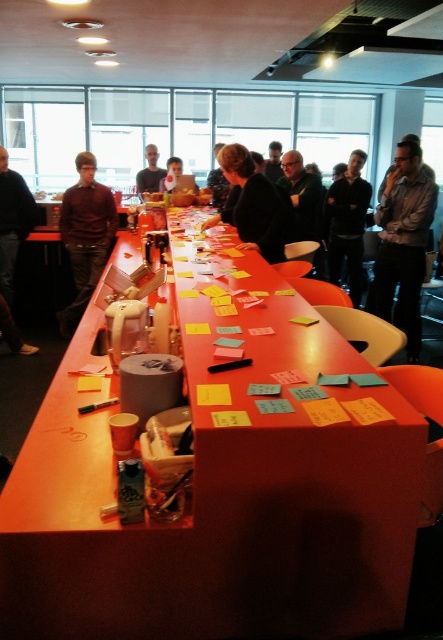
You are a photographer positioned at the entrance of the room. You want to take a photo that includes both the matte gray shirt at upper right and the black matte jacket at center. Which object should you adjust your camera angle to focus on first to ensure both are in frame?

You should focus on the matte gray shirt at upper right first because it is closer to you than the black matte jacket at center, ensuring both are visible in the frame.

From the picture: You are standing in the office and want to reach the matte black shirt at left without moving the matte orange table at center. Is the shirt closer to you than the table?

The matte orange table at center is closer to the viewer than the matte black shirt at left, so the shirt is further away from you than the table.

You are a photographer taking a group photo of the people at the meeting. You want to ensure that both the matte brown shirt at left and the matte black shirt at left are clearly visible in the photo. Given their sizes, which shirt should you focus on to ensure both are in focus?

The matte brown shirt at left is larger in size than the matte black shirt at left, so focusing on the matte brown shirt at left will ensure both are in focus since it is the larger target.